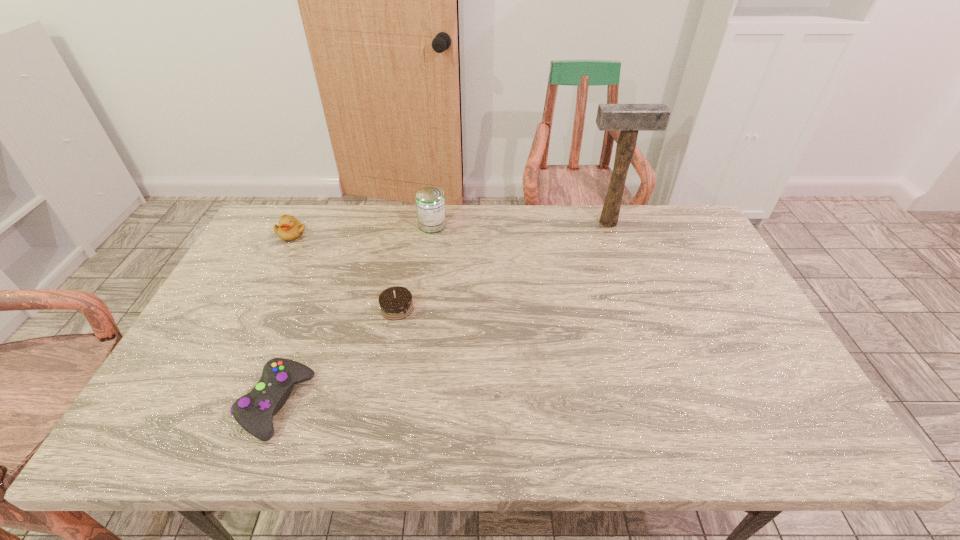
This screenshot has height=540, width=960. I want to click on unoccupied area between the fourth farthest object and the control, so click(x=337, y=356).

I want to click on unoccupied position between the second tallest object and the leftmost object, so click(x=362, y=230).

This screenshot has height=540, width=960. I want to click on free point between the nearest object and the duckling, so click(284, 319).

The height and width of the screenshot is (540, 960). What are the coordinates of `object that is the second closest one to the mallet` in the screenshot? It's located at (395, 302).

Select which object is the third closest to the can. Please provide its 2D coordinates. Your answer should be formatted as a tuple, i.e. [(x, y)], where the tuple contains the x and y coordinates of a point satisfying the conditions above.

[(628, 118)]

I want to click on free point that satisfies the following two spatial constraints: 1. at the beak of the nearest object; 2. on the right side of the duckling, so click(204, 404).

The height and width of the screenshot is (540, 960). Find the location of `vacant region that satisfies the following two spatial constraints: 1. at the beak of the leftmost object; 2. on the right side of the second object from left to right`. vacant region that satisfies the following two spatial constraints: 1. at the beak of the leftmost object; 2. on the right side of the second object from left to right is located at coordinates (204, 404).

Find the location of a particular element. vacant region that satisfies the following two spatial constraints: 1. at the beak of the nearest object; 2. on the right side of the duckling is located at coordinates click(x=204, y=404).

Locate an element on the screen. vacant space that satisfies the following two spatial constraints: 1. at the beak of the leftmost object; 2. on the left side of the nearest object is located at coordinates (204, 404).

Find the location of a particular element. This screenshot has height=540, width=960. vacant space that satisfies the following two spatial constraints: 1. on the back side of the nearest object; 2. on the right side of the fourth shortest object is located at coordinates (344, 225).